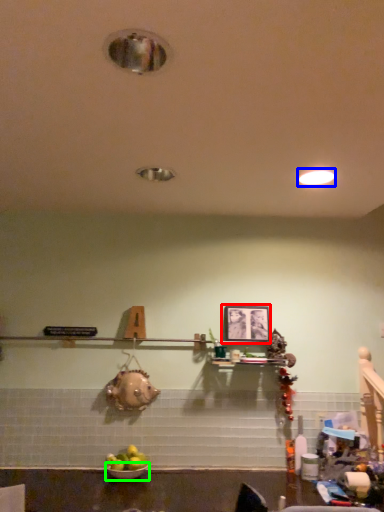
Question: Which object is the closest to the picture frame (highlighted by a red box)? Choose among these: lighting (highlighted by a blue box) or bowl (highlighted by a green box).

Choices:
 (A) lighting
 (B) bowl

Answer: (A)